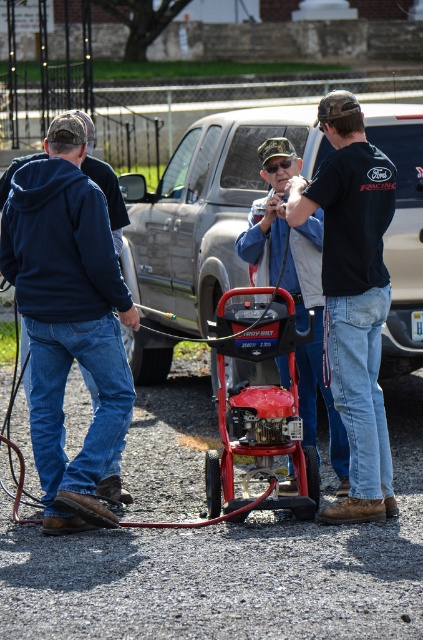
You are a delivery person who needs to hand a package to the person wearing the matte black jacket at center. The metallic silver truck at center is blocking your path. Can you walk around the truck to reach them?

The matte black jacket at center is behind the metallic silver truck at center, so you can walk around the truck to reach them as they are positioned behind it.

You are a photographer trying to capture a clear shot of the dark blue hoodie at left and the matte black jacket at center. Since you want both subjects in focus, which one should you adjust your camera focus on first?

The dark blue hoodie at left is in front of the matte black jacket at center, so you should focus on the dark blue hoodie at left first to ensure both are in focus.